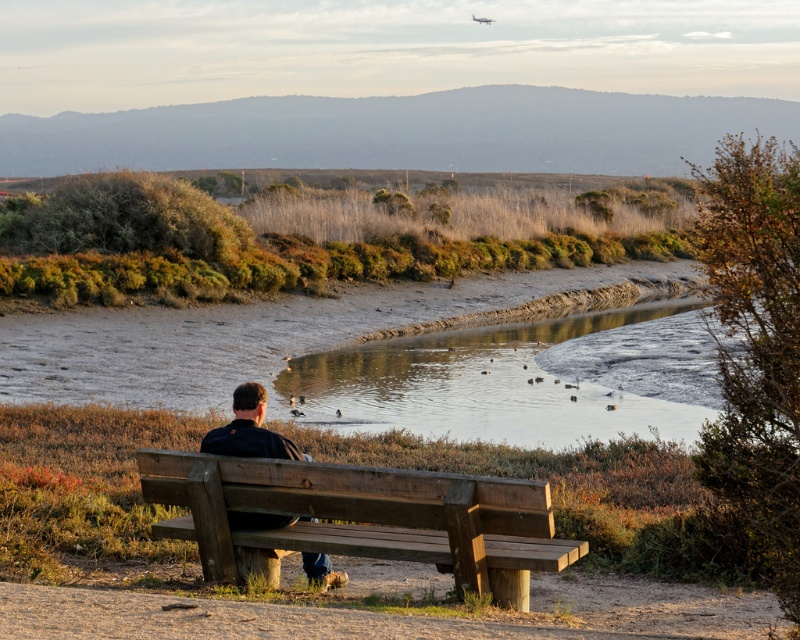
You are a photographer wanting to capture the wooden bench at center and the dark brown leather jacket at center in a single frame. Given that your camera has a fixed focal length, which object should you position closer to the camera to ensure both are in focus?

The wooden bench at center is bigger than the dark brown leather jacket at center, so positioning the wooden bench at center closer to the camera will help keep both in focus as larger objects need to be closer for proper focus with a fixed focal length.

You are standing at the origin point of the coordinate system in this image. The wooden bench is located at position 0.5, 0.5. Can you determine whether the muddy water at center is to the north or south of the wooden bench?

The muddy water at center is located at coordinate point (x=380, y=356), which is slightly to the north of the wooden bench at (x=400, y=320). Therefore, the muddy water at center is north of the wooden bench.